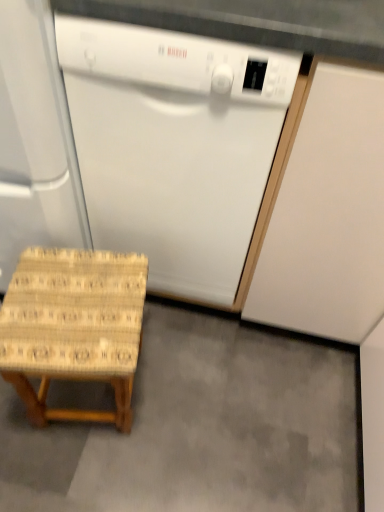
Where is `free space above woven wood stool at lower left (from a real-world perspective)`? This screenshot has height=512, width=384. free space above woven wood stool at lower left (from a real-world perspective) is located at coordinates (206, 412).